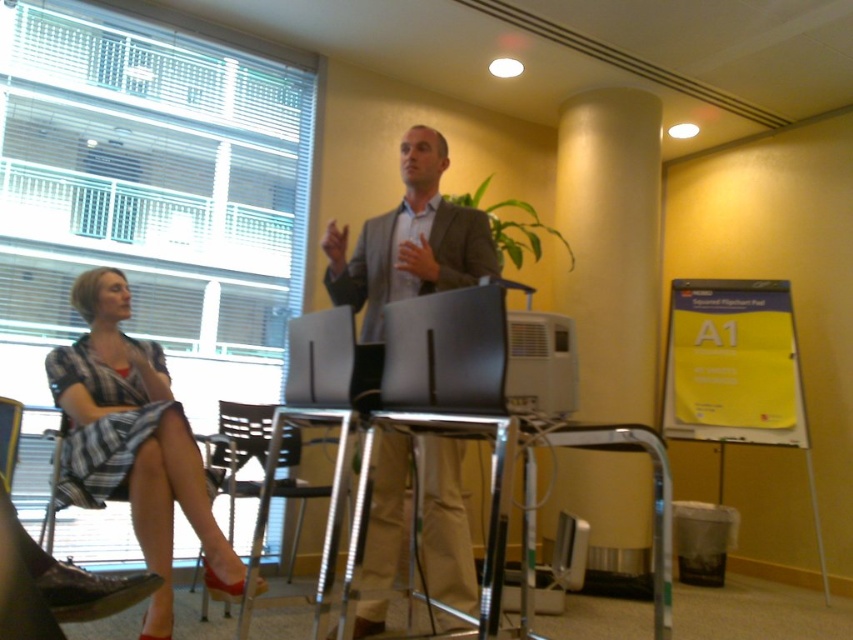
Question: Considering the relative positions of striped cotton dress at left and satin black laptop at center in the image provided, where is striped cotton dress at left located with respect to satin black laptop at center?

Choices:
 (A) right
 (B) left

Answer: (B)

Question: Which object is closer to the camera taking this photo?

Choices:
 (A) satin black laptop at center
 (B) matte black laptop at center

Answer: (A)

Question: Does matte gray suit at center lie in front of metallic silver table at center?

Choices:
 (A) no
 (B) yes

Answer: (A)

Question: In this image, where is striped cotton dress at left located relative to satin black laptop at center?

Choices:
 (A) right
 (B) left

Answer: (B)

Question: Which point is closer to the camera?

Choices:
 (A) (332, 342)
 (B) (610, 433)

Answer: (B)

Question: Among these points, which one is farthest from the camera?

Choices:
 (A) (370, 369)
 (B) (614, 449)

Answer: (A)